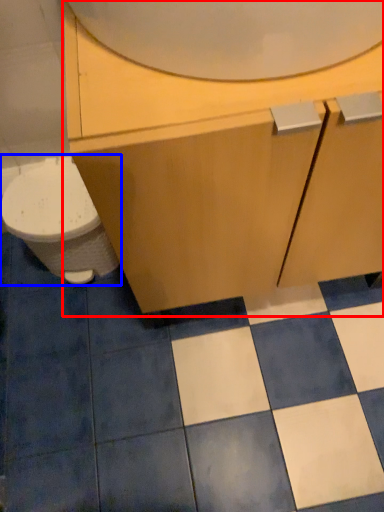
Question: Which object is further to the camera taking this photo, bathroom cabinet (highlighted by a red box) or toilet (highlighted by a blue box)?

Choices:
 (A) bathroom cabinet
 (B) toilet

Answer: (B)